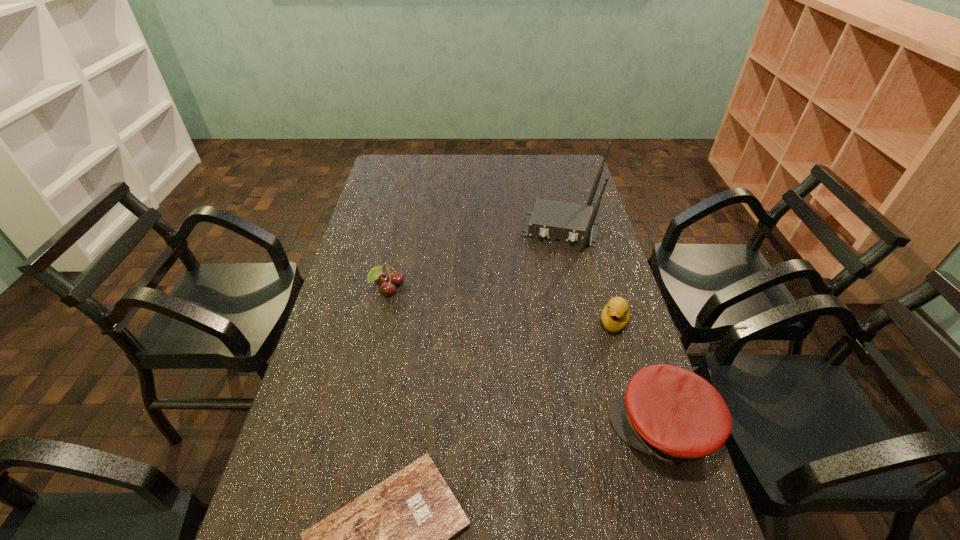
Where is `cap`? The image size is (960, 540). cap is located at coordinates (669, 412).

Identify the location of router. (572, 223).

Identify the location of the tallest object. (572, 223).

This screenshot has width=960, height=540. In order to click on cherry in this screenshot , I will do `click(376, 274)`.

Where is `duckling`? The image size is (960, 540). duckling is located at coordinates 615,316.

Locate an element on the screen. The width and height of the screenshot is (960, 540). vacant position located on the front of the cap with an emblem is located at coordinates (468, 429).

Identify the location of free space located on the front of the cap with an emblem. This screenshot has height=540, width=960. (465, 429).

You are a GUI agent. You are given a task and a screenshot of the screen. Output one action in this format:
    pyautogui.click(x=<x>, y=<y>)
    Task: Click on the free space located 0.320m on the front of the cap with an emblem
    Image resolution: width=960 pixels, height=540 pixels.
    Given the screenshot: What is the action you would take?
    pyautogui.click(x=481, y=429)

Where is `free space located on the back of the router to connect cables`? free space located on the back of the router to connect cables is located at coordinates (x=548, y=289).

Image resolution: width=960 pixels, height=540 pixels. Identify the location of vacant space located on the back of the router to connect cables. (544, 308).